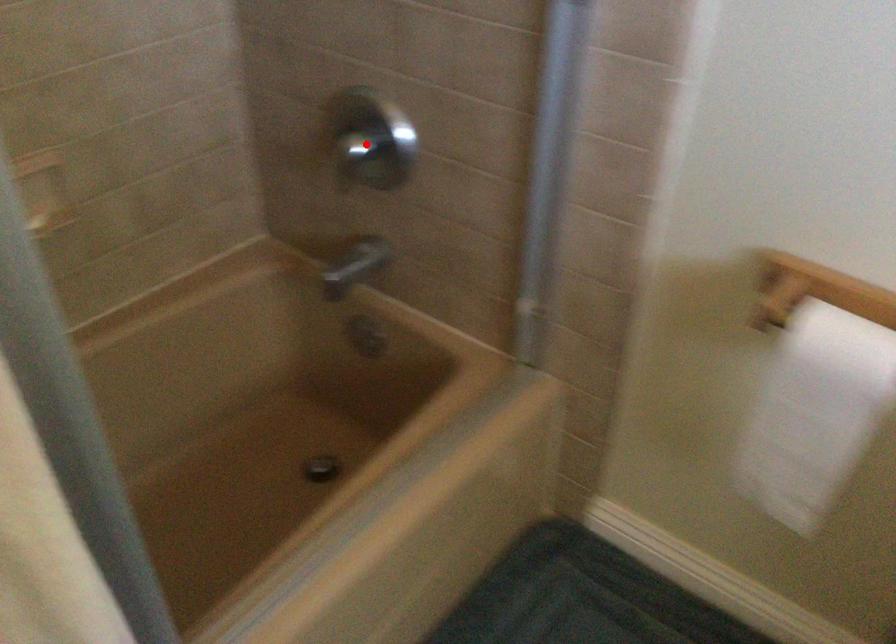
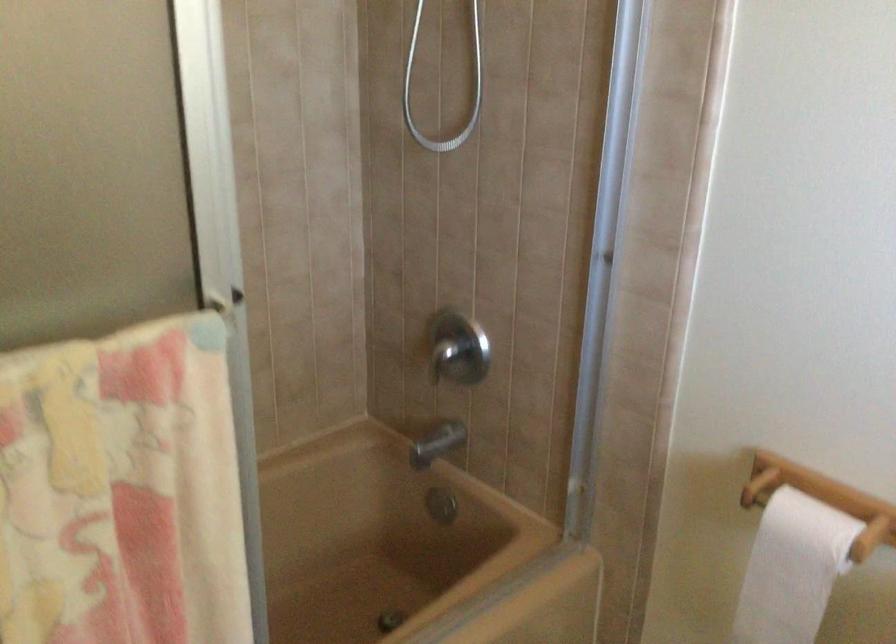
Question: I am providing you with two images of the same scene from different viewpoints. A red point is shown in image1. For the corresponding object point in image2, is it positioned nearer or farther from the camera?

Choices:
 (A) Nearer
 (B) Farther

Answer: (B)